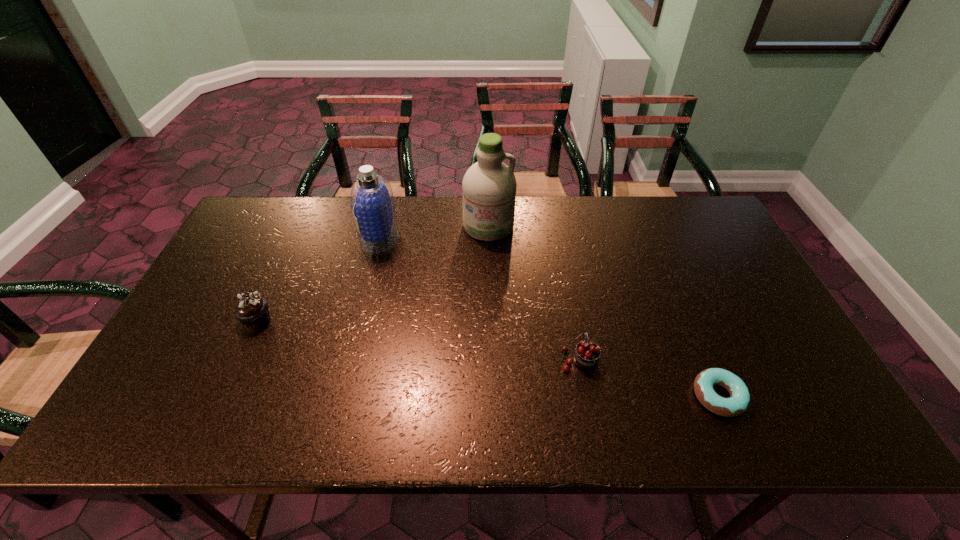
I want to click on free location located on the front label of the tallest object, so click(x=490, y=281).

Where is `vacant space located on the right of the second tallest object`? Image resolution: width=960 pixels, height=540 pixels. vacant space located on the right of the second tallest object is located at coordinates (437, 238).

Where is `vacant space located on the handle side of the second object from right to left`? vacant space located on the handle side of the second object from right to left is located at coordinates (565, 286).

I want to click on vacant position located 0.210m on the handle side of the second object from right to left, so click(x=564, y=284).

This screenshot has height=540, width=960. Find the location of `free spot located on the handle side of the second object from right to left`. free spot located on the handle side of the second object from right to left is located at coordinates (567, 296).

In order to click on vacant space situated 0.350m on the back of the cupcake in this screenshot , I will do `click(300, 226)`.

Where is `vacant space located on the back of the rightmost object`? The height and width of the screenshot is (540, 960). vacant space located on the back of the rightmost object is located at coordinates (700, 353).

Where is `object at the near edge`? The height and width of the screenshot is (540, 960). object at the near edge is located at coordinates (738, 403).

The height and width of the screenshot is (540, 960). Find the location of `object located in the left edge section of the desktop`. object located in the left edge section of the desktop is located at coordinates (251, 309).

Identify the location of vacant space at the far edge. The height and width of the screenshot is (540, 960). (644, 220).